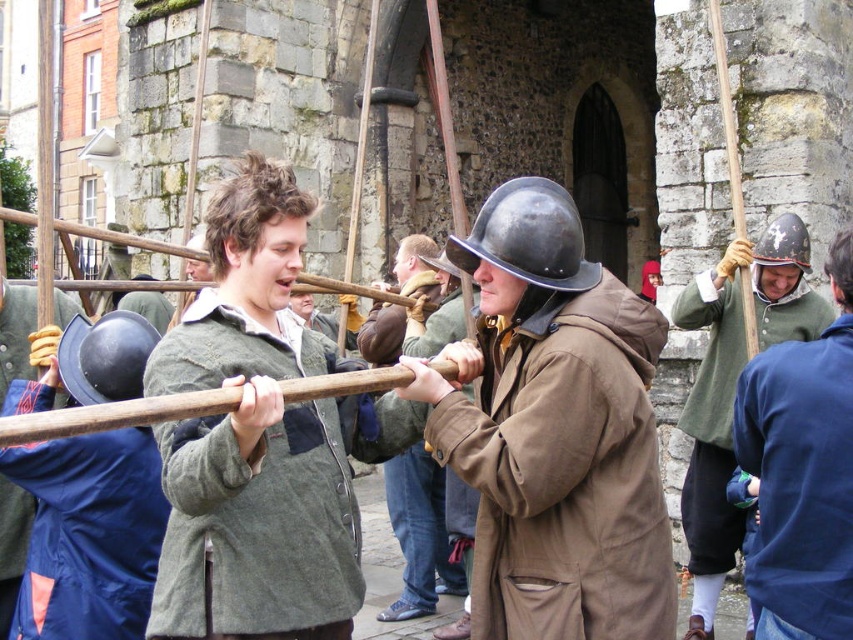
Who is positioned more to the right, brown leather coat at center or matte black helmet at left?

Positioned to the right is brown leather coat at center.

Image resolution: width=853 pixels, height=640 pixels. Find the location of `brown leather coat at center`. brown leather coat at center is located at coordinates (554, 429).

Which of these two, green woolen coat at center or shiny black helmet at center, stands shorter?

shiny black helmet at center

Does green woolen coat at center have a larger size compared to shiny black helmet at center?

Yes, green woolen coat at center is bigger than shiny black helmet at center.

This screenshot has width=853, height=640. In order to click on green woolen coat at center in this screenshot , I will do `click(260, 440)`.

Image resolution: width=853 pixels, height=640 pixels. I want to click on green woolen coat at center, so click(x=260, y=440).

Is green woolen coat at center closer to the viewer compared to brown matte coat at center?

Yes, it is in front of brown matte coat at center.

The height and width of the screenshot is (640, 853). Describe the element at coordinates (260, 440) in the screenshot. I see `green woolen coat at center` at that location.

Where is `green woolen coat at center`? The image size is (853, 640). green woolen coat at center is located at coordinates (260, 440).